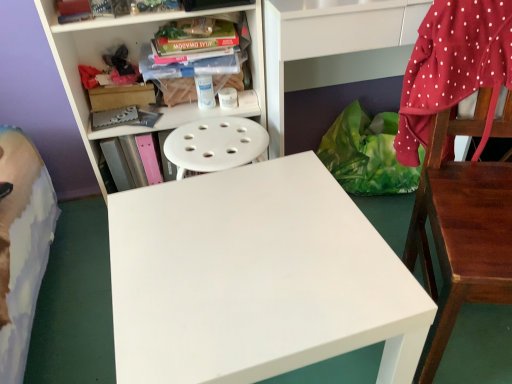
Question: Based on their positions, is wooden chair at right located to the left or right of red polka dot fabric at right?

Choices:
 (A) right
 (B) left

Answer: (A)

Question: In terms of width, does wooden chair at right look wider or thinner when compared to red polka dot fabric at right?

Choices:
 (A) thin
 (B) wide

Answer: (B)

Question: Based on their relative distances, which object is farther from the green plastic bag at lower right?

Choices:
 (A) red polka dot fabric at right
 (B) white plastic bookcase at upper left
 (C) white matte table at center
 (D) pink matte book at center-left, the 1th book from the bottom
 (E) wooden chair at right

Answer: (D)

Question: Which of these objects is positioned closest to the wooden chair at right?

Choices:
 (A) white plastic bookcase at upper left
 (B) red polka dot fabric at right
 (C) pink matte book at center-left, the 1th book from the bottom
 (D) hardcover book at upper center, acting as the 2th book starting from the bottom
 (E) green plastic bag at lower right

Answer: (B)